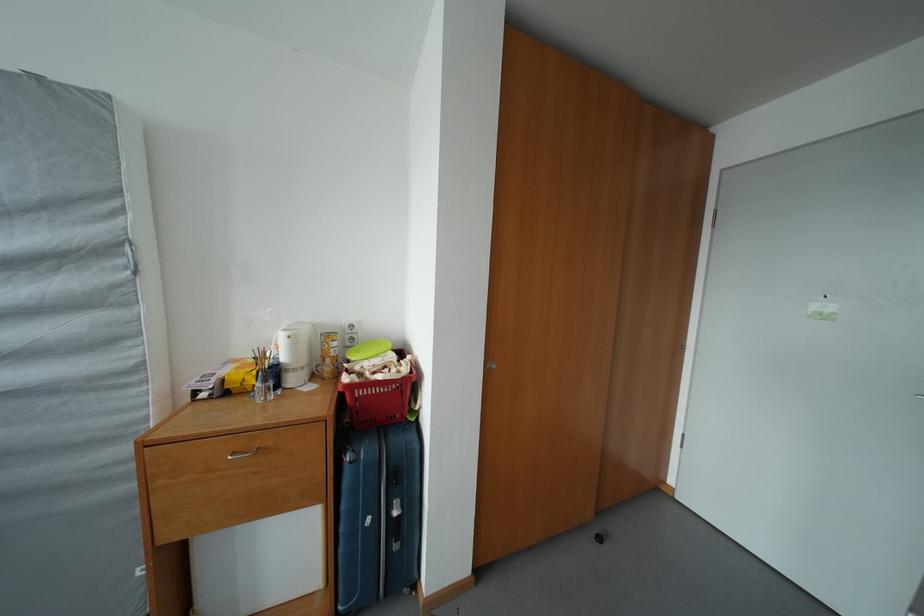
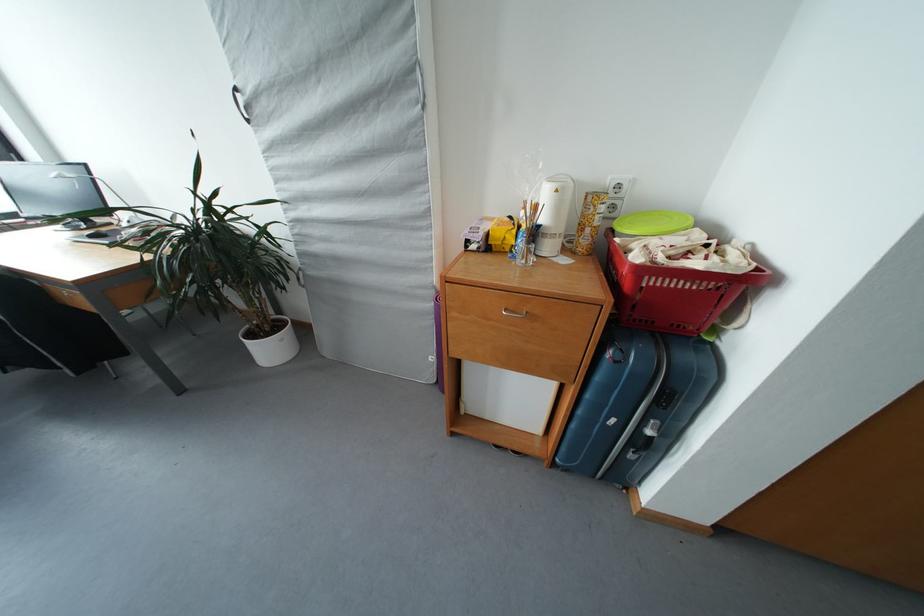
The point at (x=388, y=395) is marked in the first image. Where is the corresponding point in the second image?

(694, 291)